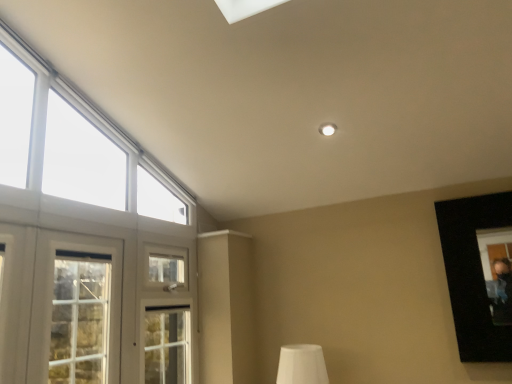
Question: Is white glass window at upper left, the first window positioned from the top, located outside white wooden window at left, which ranks as the 1th window in bottom-to-top order?

Choices:
 (A) yes
 (B) no

Answer: (A)

Question: Is white glass window at upper left, the second window ordered from the bottom, turned away from white wooden window at left, which ranks as the 1th window in bottom-to-top order?

Choices:
 (A) yes
 (B) no

Answer: (B)

Question: Does white glass window at upper left, the second window ordered from the bottom, have a lesser height compared to white wooden window at left, marked as the 2th window in a top-to-bottom arrangement?

Choices:
 (A) yes
 (B) no

Answer: (B)

Question: Does white glass window at upper left, the first window positioned from the top, appear on the right side of white wooden window at left, which ranks as the 1th window in bottom-to-top order?

Choices:
 (A) no
 (B) yes

Answer: (B)

Question: Is white glass window at upper left, the first window positioned from the top, positioned behind white wooden window at left, which ranks as the 1th window in bottom-to-top order?

Choices:
 (A) yes
 (B) no

Answer: (B)

Question: From a real-world perspective, is white glass window at upper left, the second window ordered from the bottom, positioned under white wooden window at left, marked as the 2th window in a top-to-bottom arrangement, based on gravity?

Choices:
 (A) yes
 (B) no

Answer: (B)

Question: Could white matte table lamp at lower center be considered to be inside white glass window at upper left, the second window ordered from the bottom?

Choices:
 (A) yes
 (B) no

Answer: (B)

Question: Is white glass window at upper left, the second window ordered from the bottom, to the left of white matte table lamp at lower center from the viewer's perspective?

Choices:
 (A) no
 (B) yes

Answer: (B)

Question: Does white glass window at upper left, the first window positioned from the top, turn towards white matte table lamp at lower center?

Choices:
 (A) yes
 (B) no

Answer: (B)

Question: Is white glass window at upper left, the second window ordered from the bottom, bigger than white matte table lamp at lower center?

Choices:
 (A) yes
 (B) no

Answer: (A)

Question: Is white glass window at upper left, the first window positioned from the top, at the right side of white matte table lamp at lower center?

Choices:
 (A) yes
 (B) no

Answer: (B)

Question: From the image's perspective, is white glass window at upper left, the first window positioned from the top, located beneath white matte table lamp at lower center?

Choices:
 (A) yes
 (B) no

Answer: (B)

Question: Is white wooden window at left, marked as the 2th window in a top-to-bottom arrangement, positioned in front of white matte table lamp at lower center?

Choices:
 (A) no
 (B) yes

Answer: (B)